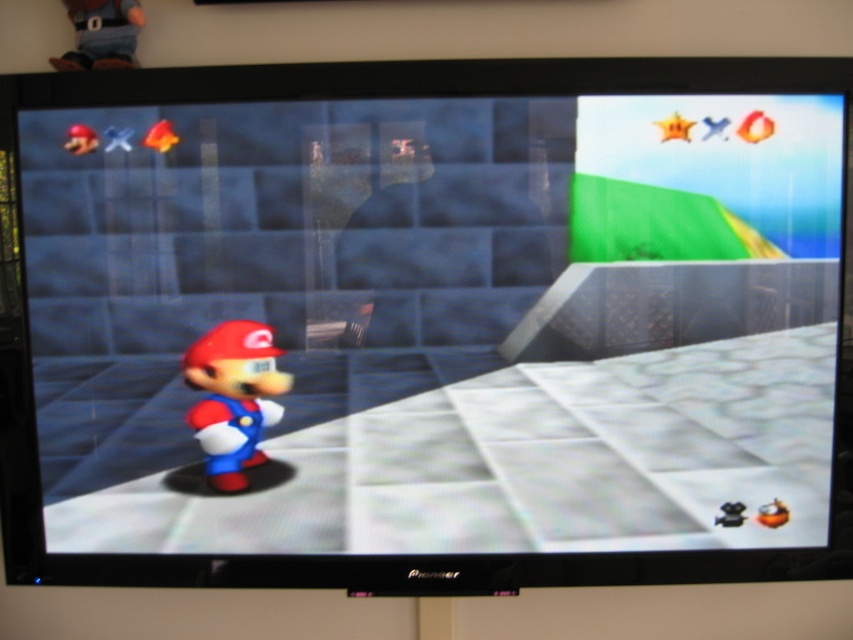
Mario is standing on a white tiled surface in a video game scene. There are two versions of Mario shown here, one labeled as smooth matte Mario at center and the other as matte plastic Mario at center. Which Mario is closer to the viewer?

The smooth matte mario at center is closer to the viewer because it is in front of the matte plastic mario at center according to the description.

From the picture: You are a game developer analyzing the Mario character in the game scene. You notice two versions of Mario on the screen. Which Mario, the smooth matte mario at center or the matte plastic mario at center, has a greater height?

The smooth matte mario at center is much taller than the matte plastic mario at center according to the description.